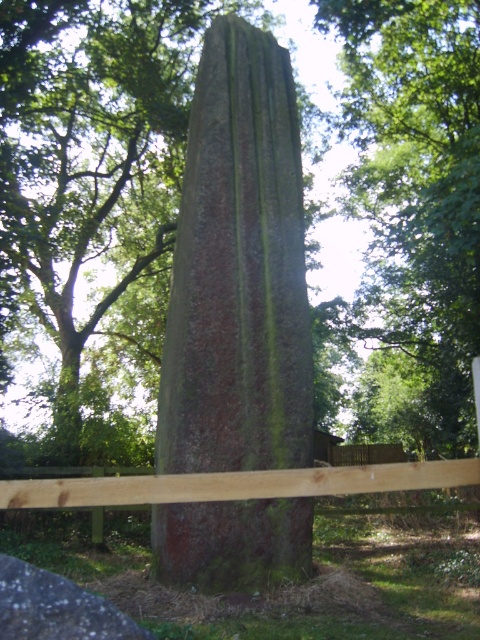
Question: Which object is the closest to the green mossy stone obelisk at center?

Choices:
 (A) brown wooden fence at center
 (B) green mossy stone at center

Answer: (B)

Question: Does green mossy stone obelisk at center come behind green mossy stone at center?

Choices:
 (A) no
 (B) yes

Answer: (B)

Question: Among these objects, which one is nearest to the camera?

Choices:
 (A) green mossy stone at center
 (B) green mossy stone obelisk at center
 (C) brown wooden fence at center

Answer: (C)

Question: From the image, what is the correct spatial relationship of green mossy stone obelisk at center in relation to green mossy stone at center?

Choices:
 (A) below
 (B) above

Answer: (B)

Question: Which object is farther from the camera taking this photo?

Choices:
 (A) brown wooden fence at center
 (B) green mossy stone obelisk at center

Answer: (B)

Question: Is green mossy stone obelisk at center smaller than brown wooden fence at center?

Choices:
 (A) yes
 (B) no

Answer: (B)